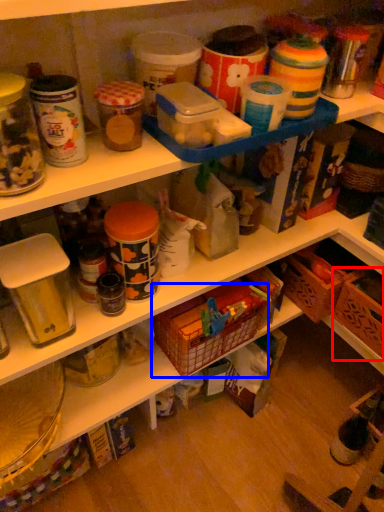
Question: Which point is further to the camera, basket (highlighted by a red box) or basket (highlighted by a blue box)?

Choices:
 (A) basket
 (B) basket

Answer: (A)